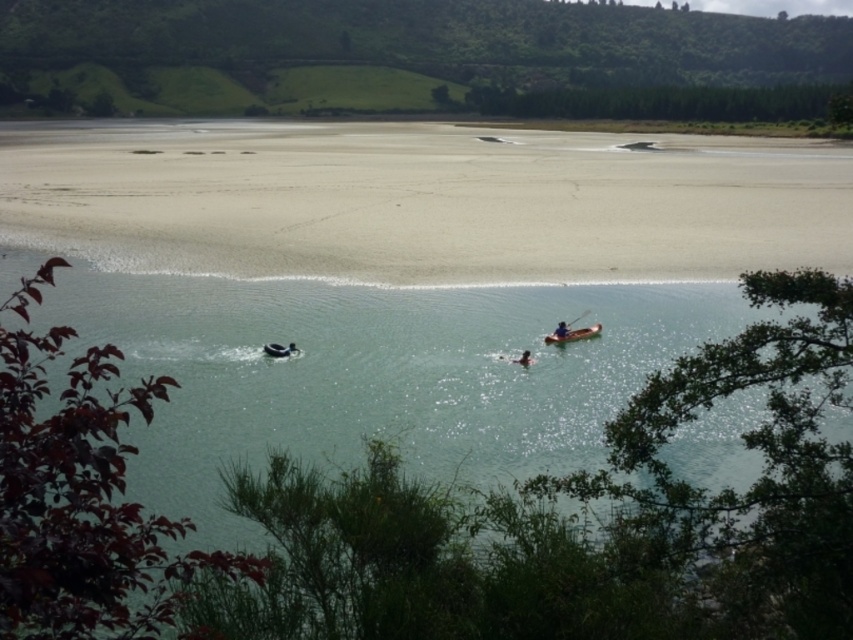
Between smooth brown kayak at center and black rubber ring at lower center, which one has more height?

smooth brown kayak at center is taller.

Does smooth brown kayak at center have a smaller size compared to black rubber ring at lower center?

No, smooth brown kayak at center is not smaller than black rubber ring at lower center.

You are a GUI agent. You are given a task and a screenshot of the screen. Output one action in this format:
    pyautogui.click(x=<x>, y=<y>)
    Task: Click on the smooth brown kayak at center
    
    Given the screenshot: What is the action you would take?
    pyautogui.click(x=523, y=358)

Find the location of `smooth brown kayak at center`. smooth brown kayak at center is located at coordinates click(x=523, y=358).

Where is `sandy shore at lower center`? Image resolution: width=853 pixels, height=640 pixels. sandy shore at lower center is located at coordinates (422, 200).

Measure the distance between point [421,177] and camera.

Point [421,177] is 77.64 meters away from camera.

Locate an element on the screen. Image resolution: width=853 pixels, height=640 pixels. sandy shore at lower center is located at coordinates (422, 200).

Does blue fabric kayak at center have a lesser width compared to smooth brown kayak at center?

Yes.

Does blue fabric kayak at center have a larger size compared to smooth brown kayak at center?

Yes.

Is point (560, 326) more distant than point (519, 362)?

Yes, it is.

In order to click on blue fabric kayak at center in this screenshot , I will do click(x=561, y=330).